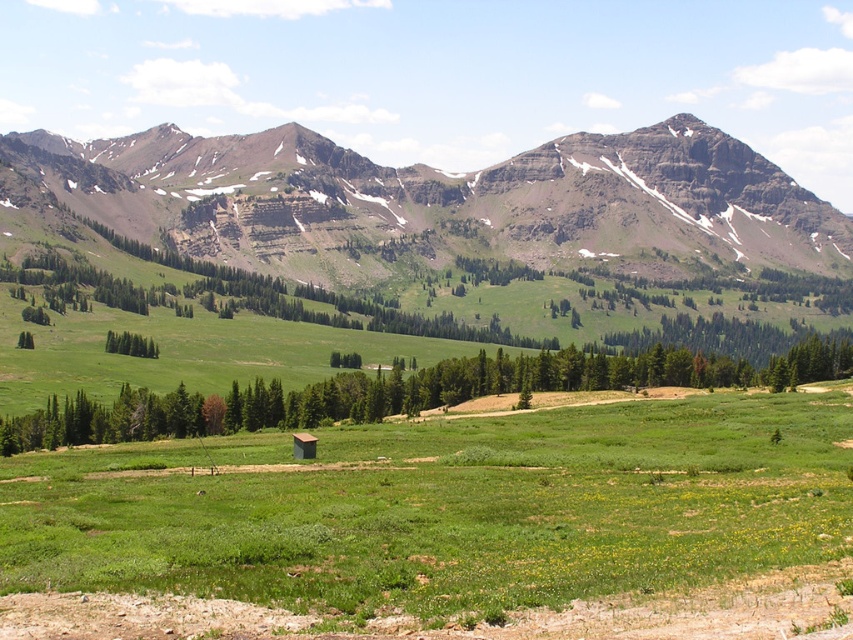
You are an environmental scientist assessing the landscape. You need to determine which object occupies a larger area in the image for a report. Based on the scene, which is bigger between the rocky brown mountain range at upper center and the green leafy tree at center?

The rocky brown mountain range at upper center is bigger than the green leafy tree at center according to the description.